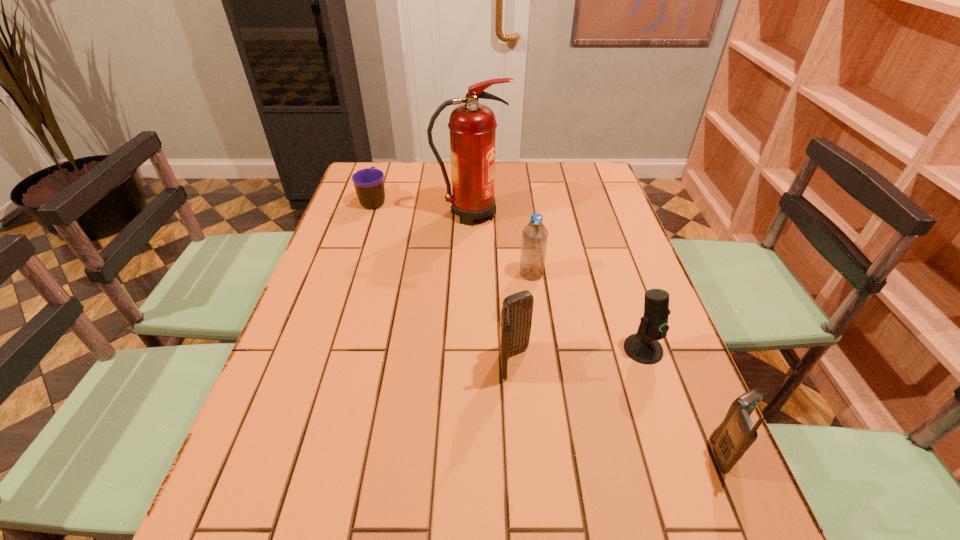
Identify the location of the taller cellular telephone. [516, 315].

Find the location of a particular element. This screenshot has height=540, width=960. the fifth shortest object is located at coordinates (516, 315).

In order to click on the nearer cellular telephone in this screenshot , I will do [x=732, y=438].

At what (x,y) coordinates should I click in order to perform the action: click on the right cellular telephone. Please return your answer as a coordinate pair (x, y). Looking at the image, I should click on (732, 438).

Identify the location of water bottle. This screenshot has width=960, height=540. (534, 236).

The image size is (960, 540). In order to click on the leftmost object in this screenshot , I will do `click(369, 183)`.

The image size is (960, 540). Identify the location of the shortest object. (369, 183).

Where is `the tallest object`? The width and height of the screenshot is (960, 540). the tallest object is located at coordinates (472, 125).

Where is `microphone`? The image size is (960, 540). microphone is located at coordinates click(643, 347).

At what (x,y) coordinates should I click in order to perform the action: click on free region located on the keyboard of the farther cellular telephone. Please return your answer as a coordinate pair (x, y). This screenshot has width=960, height=540. Looking at the image, I should click on [x=638, y=362].